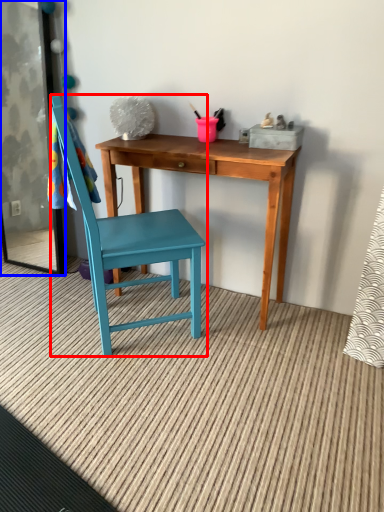
Question: Which object is closer to the camera taking this photo, chair (highlighted by a red box) or screen door (highlighted by a blue box)?

Choices:
 (A) chair
 (B) screen door

Answer: (A)